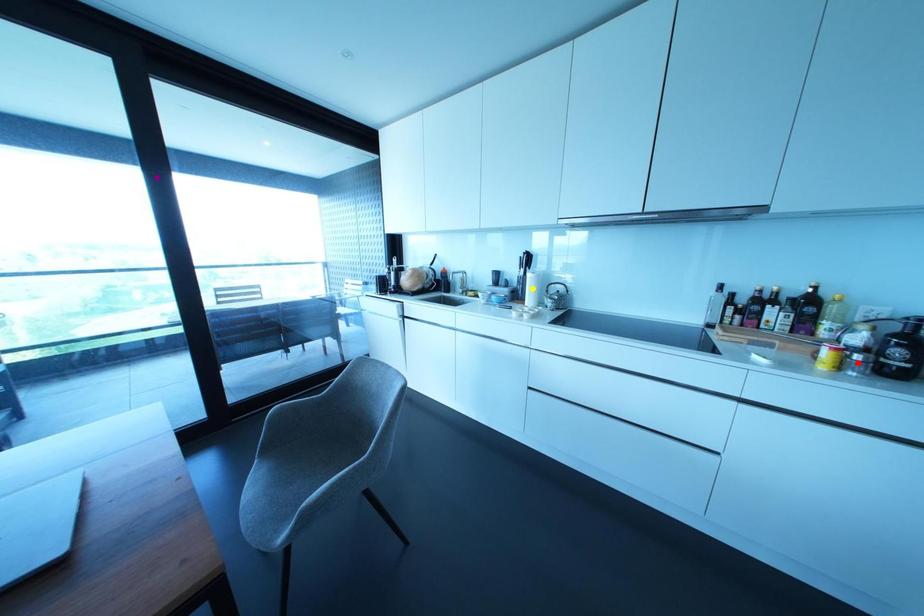
Order these from nearest to farthest:
- red point
- purple point
- yellow point

red point < purple point < yellow point